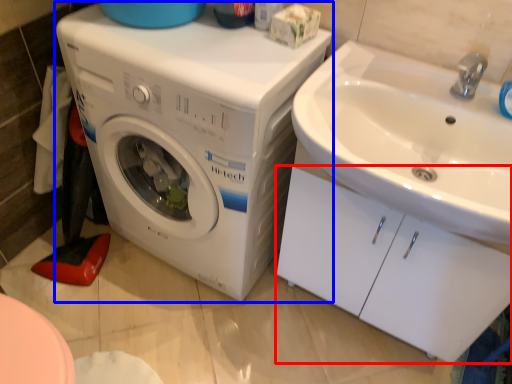
Question: Which object is further to the camera taking this photo, drawer (highlighted by a red box) or washing machine (highlighted by a blue box)?

Choices:
 (A) drawer
 (B) washing machine

Answer: (B)